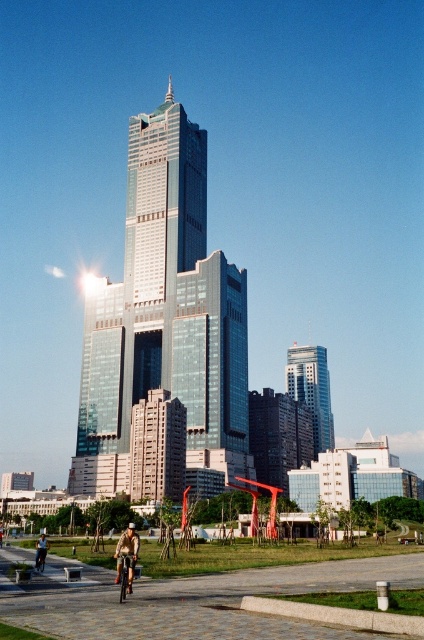
Question: Which point is farther to the camera?

Choices:
 (A) silver metallic skyscraper at center
 (B) light brown leather jacket at lower center

Answer: (A)

Question: Estimate the real-world distances between objects in this image. Which object is closer to the shiny glass skyscraper at center?

Choices:
 (A) light brown leather jacket at lower center
 (B) silver metallic bicycle at center
 (C) silver metallic skyscraper at center

Answer: (A)

Question: Considering the real-world distances, which object is farthest from the silver metallic bicycle at center?

Choices:
 (A) silver metallic skyscraper at center
 (B) light brown leather jacket at lower center

Answer: (A)

Question: Can you confirm if silver metallic skyscraper at center is positioned below silver metallic bicycle at center?

Choices:
 (A) no
 (B) yes

Answer: (A)

Question: Observing the image, what is the correct spatial positioning of silver metallic bicycle at center in reference to light brown leather jacket at lower center?

Choices:
 (A) right
 (B) left

Answer: (A)

Question: Does shiny glass skyscraper at center have a smaller size compared to light brown leather jacket at lower center?

Choices:
 (A) no
 (B) yes

Answer: (A)